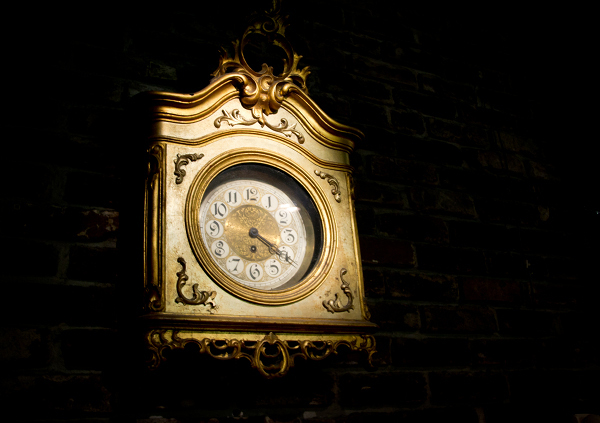
Identify the location of gold center of clock face. This screenshot has width=600, height=423. (239, 223).